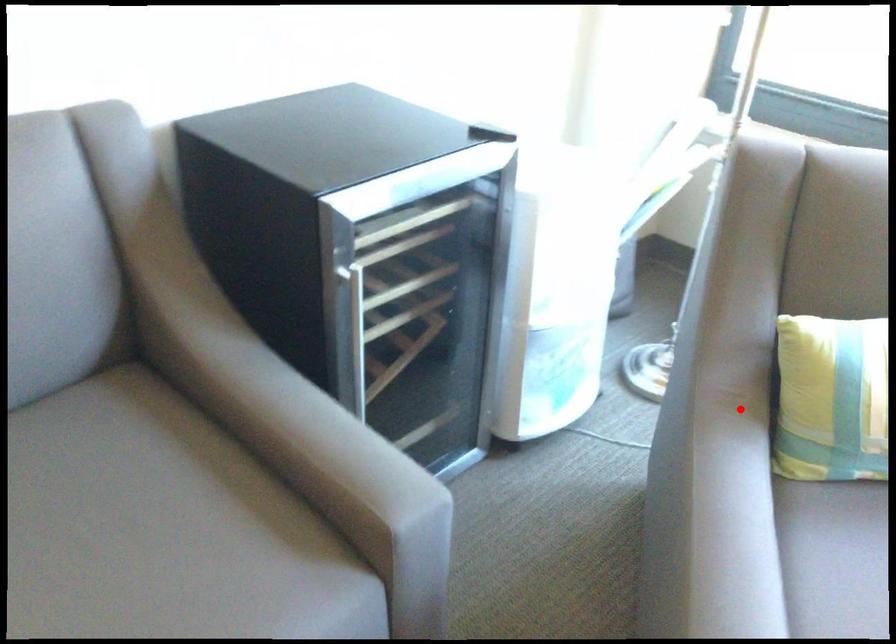
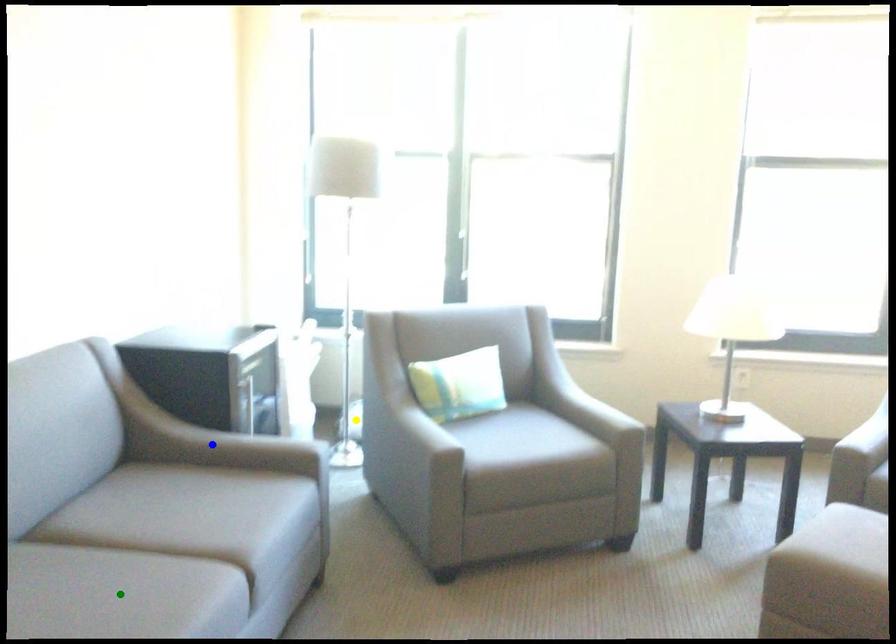
Question: I am providing you with two images of the same scene from different viewpoints. A red point is marked on the first image. You are given multiple points on the second image. In image 2, which mark is for the same physical point as the one in image 1?

Choices:
 (A) yellow point
 (B) blue point
 (C) green point

Answer: (A)